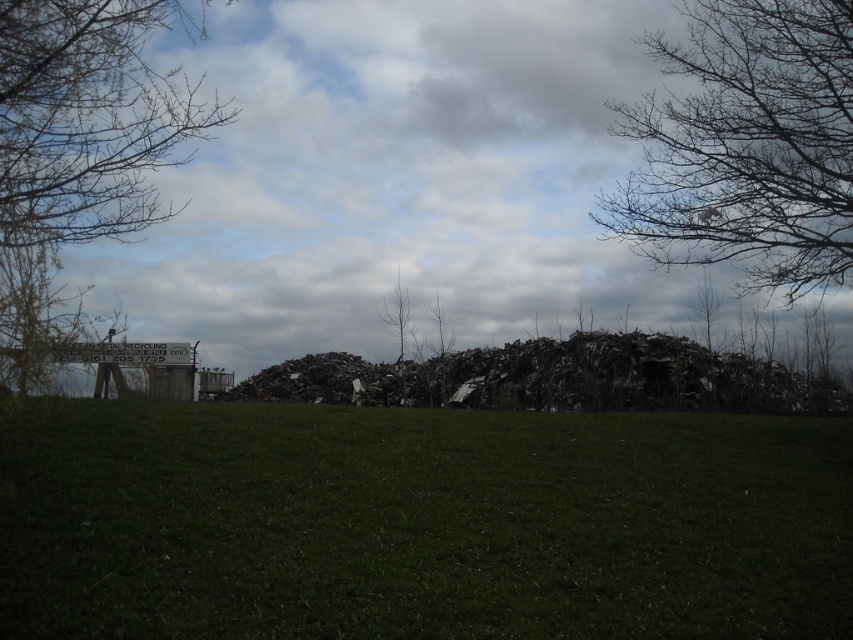
You are a delivery person trying to navigate through the grassy field. You see the bare branches at upper left and the dark metallic debris at center. Which object is higher up in the image?

The bare branches at upper left is located above dark metallic debris at center, so the bare branches at upper left is higher up in the image.

You are a gardener planning to mow the green grassy field at lower center. You notice the bare branches at upper right. Will the branches block the sunlight reaching the grass during midday?

The green grassy field at lower center is shorter than the bare branches at upper right, so during midday when the sun is high, the branches might cast shadows over the grass, potentially blocking some sunlight. However, since the branches are bare, they might allow more light to pass through compared to if they had leaves, so the obstruction would be less than if they were leafy.